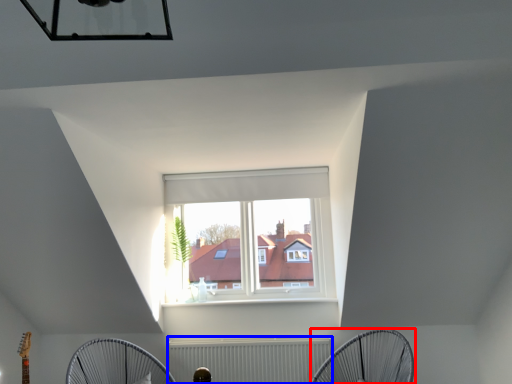
Question: Which object is further to the camera taking this photo, mechanical fan (highlighted by a red box) or radiator (highlighted by a blue box)?

Choices:
 (A) mechanical fan
 (B) radiator

Answer: (B)